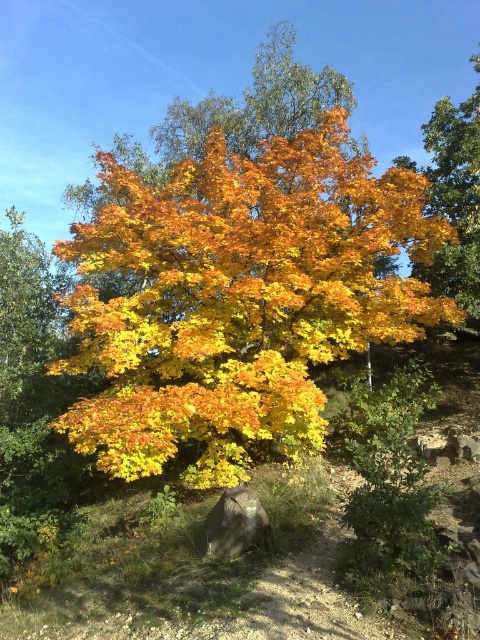
Consider the image. You are a hiker who wants to place a small flag on the gray rough rock at lower center without it being hidden by the golden yellow leaves at center. Which direction should you place the flag to avoid the leaves?

The golden yellow leaves at center is located above the gray rough rock at lower center. To avoid the leaves hiding the flag, place it in a direction away from the leaves, such as to the side or behind the rock.

You are standing in the autumn forest and want to pick up the gray rough rock at lower center. However, there are golden yellow leaves at center in your way. Can you reach the rock without stepping on the leaves?

The golden yellow leaves at center are closer to you than the gray rough rock at lower center, so you would have to step over or around the leaves to reach the rock.